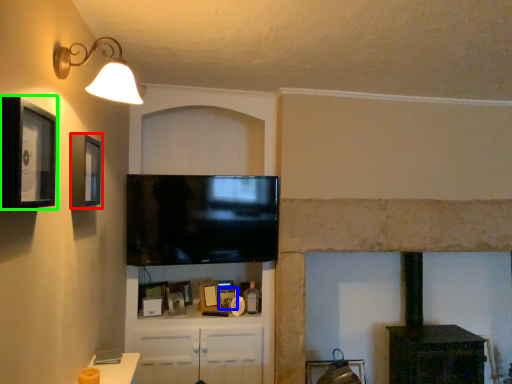
Question: Considering the real-world distances, which object is farthest from picture frame (highlighted by a red box)? picture frame (highlighted by a blue box) or picture frame (highlighted by a green box)?

Choices:
 (A) picture frame
 (B) picture frame

Answer: (A)